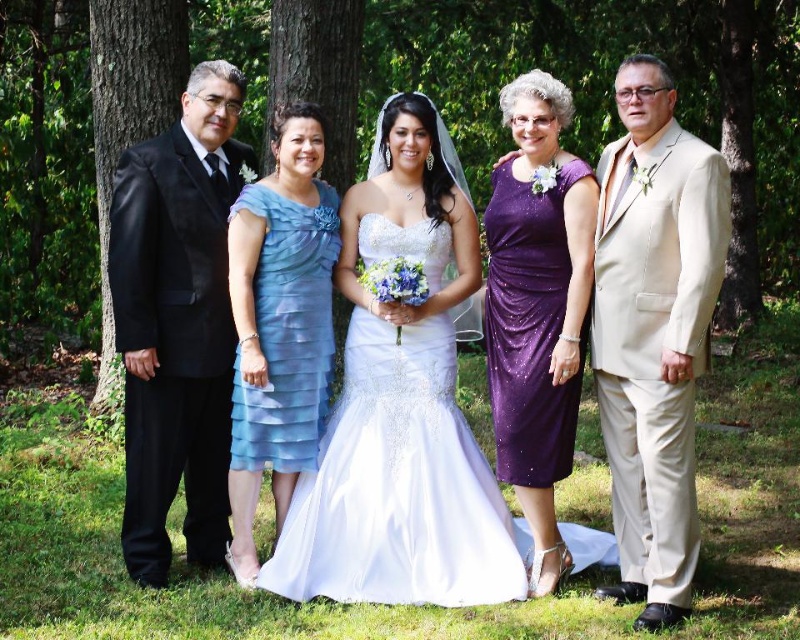
Can you confirm if beige satin suit at right is positioned to the right of light blue chiffon dress at center?

Yes, beige satin suit at right is to the right of light blue chiffon dress at center.

Who is shorter, beige satin suit at right or light blue chiffon dress at center?

light blue chiffon dress at center

Which is behind, point (636, 60) or point (280, 356)?

Point (280, 356)

Find the location of a particular element. beige satin suit at right is located at coordinates (654, 332).

What do you see at coordinates (654, 332) in the screenshot?
I see `beige satin suit at right` at bounding box center [654, 332].

Is point (662, 544) behind point (172, 29)?

No, it is in front of (172, 29).

Is point (658, 104) positioned before point (182, 65)?

Yes, point (658, 104) is closer to viewer.

At what (x,y) coordinates should I click in order to perform the action: click on beige satin suit at right. Please return your answer as a coordinate pair (x, y). The width and height of the screenshot is (800, 640). Looking at the image, I should click on (654, 332).

Does point (193, 157) come in front of point (302, 173)?

Yes.

Does shiny black suit at left appear on the right side of light blue chiffon dress at center?

Incorrect, shiny black suit at left is not on the right side of light blue chiffon dress at center.

Find the location of a particular element. shiny black suit at left is located at coordinates (178, 321).